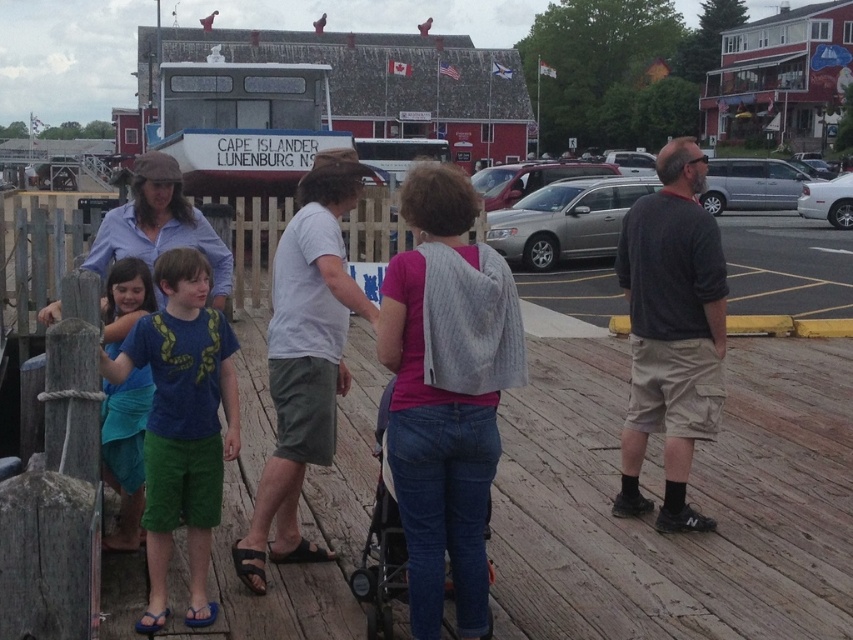
Question: Is dark gray cotton shirt at center positioned at the back of blue fabric shirt at left?

Choices:
 (A) no
 (B) yes

Answer: (B)

Question: Among these points, which one is nearest to the camera?

Choices:
 (A) (144, 376)
 (B) (409, 323)
 (C) (238, 449)

Answer: (B)

Question: Is dark gray cotton shirt at center thinner than blue fabric shirt at left?

Choices:
 (A) no
 (B) yes

Answer: (A)

Question: Does dark gray cotton shirt at center have a smaller size compared to blue fabric shirt at left?

Choices:
 (A) yes
 (B) no

Answer: (B)

Question: Based on their relative distances, which object is nearer to the blue fabric shirt at left?

Choices:
 (A) dark gray cotton shirt at center
 (B) blue t-shirt at center

Answer: (B)

Question: Which of these objects is positioned closest to the blue cotton shirt at left?

Choices:
 (A) dark gray cotton shirt at center
 (B) blue fabric shirt at left

Answer: (B)